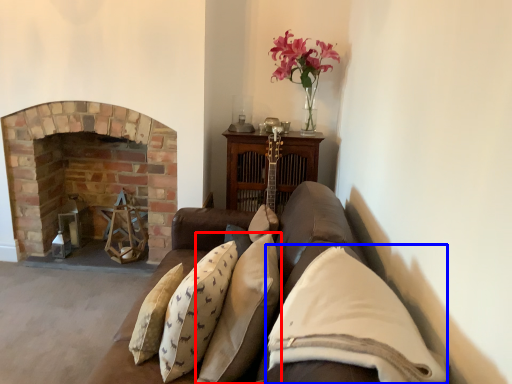
Question: Which object is closer to the camera taking this photo, pillow (highlighted by a red box) or pillow (highlighted by a blue box)?

Choices:
 (A) pillow
 (B) pillow

Answer: (B)